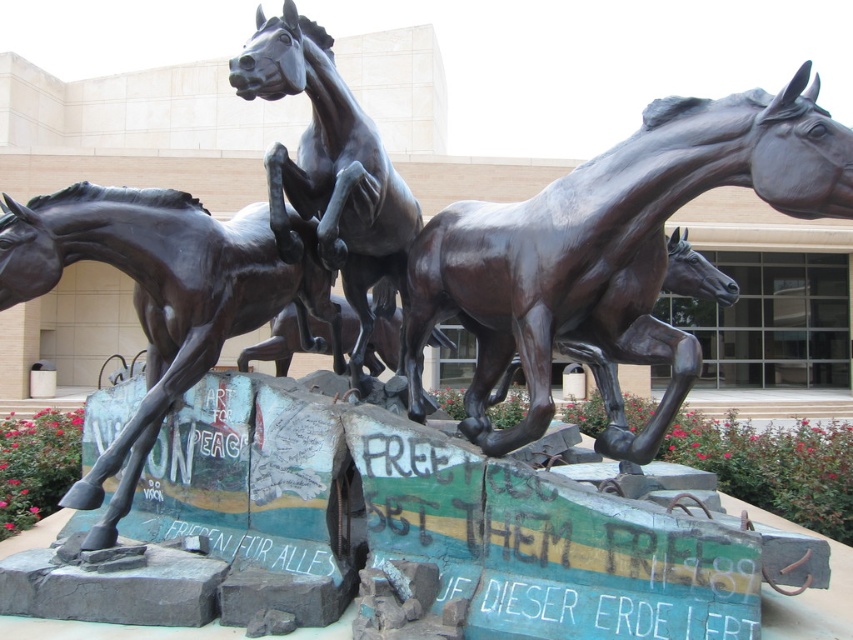
You are standing in front of the sculpture and want to touch the point at coordinates point [828,129]. Considering the sculpture is 10 feet tall, can you reach it without a ladder?

The point [828,129] is 9.26 feet away from the viewer. Since the sculpture is 10 feet tall, the point is within reach if you can extend your arm to that height, but typically, without a ladder, most people cannot reach 9.26 feet. Therefore, you would likely need a ladder to touch that point.